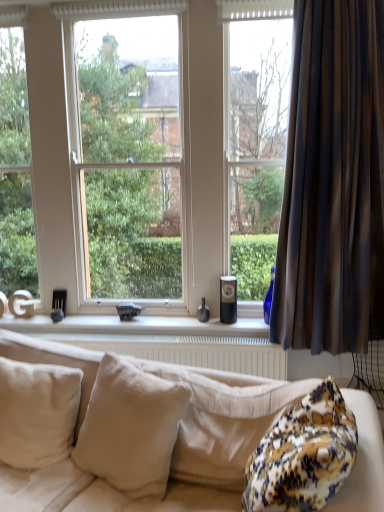
The image size is (384, 512). Identify the location of white matte window sill at center. (137, 326).

Locate an element on the screen. The width and height of the screenshot is (384, 512). beige cotton pillow at lower left, which appears as the 1th pillow when viewed from the left is located at coordinates (37, 412).

In order to face transparent glass window at center, should I rotate leftwards or rightwards?

→ To align with it, rotate left about 8.794°.

The width and height of the screenshot is (384, 512). What do you see at coordinates (333, 182) in the screenshot?
I see `brown striped curtain at right` at bounding box center [333, 182].

Image resolution: width=384 pixels, height=512 pixels. Describe the element at coordinates (363, 460) in the screenshot. I see `beige fabric couch at lower center` at that location.

Where is `white matte window sill at center`? This screenshot has height=512, width=384. white matte window sill at center is located at coordinates (137, 326).

Does white matte window sill at center have a lesser width compared to beige fabric couch at lower center?

Yes, white matte window sill at center is thinner than beige fabric couch at lower center.

Is white matte window sill at center behind beige fabric couch at lower center?

Yes.

Where is `window sill above the beige fabric couch at lower center (from the image's perspective)`? This screenshot has height=512, width=384. window sill above the beige fabric couch at lower center (from the image's perspective) is located at coordinates (x=137, y=326).

Where is `window located on the left of beige fabric pillow at center, acting as the 2th pillow starting from the left`? The height and width of the screenshot is (512, 384). window located on the left of beige fabric pillow at center, acting as the 2th pillow starting from the left is located at coordinates (138, 147).

Can you tell me how much transparent glass window at center and beige fabric pillow at center, acting as the 2th pillow starting from the left, differ in facing direction?

15.2 degrees separate the facing orientations of transparent glass window at center and beige fabric pillow at center, acting as the 2th pillow starting from the left.

Is beige fabric pillow at center, arranged as the first pillow when viewed from the right, at the back of transparent glass window at center?

That's not correct — transparent glass window at center is not looking away from beige fabric pillow at center, arranged as the first pillow when viewed from the right.

Considering the points (1, 16) and (150, 467), which point is behind, point (1, 16) or point (150, 467)?

The point (1, 16) is farther from the camera.

From a real-world perspective, between beige cotton pillow at lower left, which is counted as the second pillow, starting from the right, and brown striped curtain at right, who is vertically lower?

From a 3D spatial view, beige cotton pillow at lower left, which is counted as the second pillow, starting from the right, is below.

Does beige cotton pillow at lower left, which appears as the 1th pillow when viewed from the left, lie behind brown striped curtain at right?

No.

Is beige cotton pillow at lower left, which appears as the 1th pillow when viewed from the left, spatially inside brown striped curtain at right, or outside of it?

beige cotton pillow at lower left, which appears as the 1th pillow when viewed from the left, is located beyond the bounds of brown striped curtain at right.

Where is `radiator located behind the beige fabric pillow at center, arranged as the first pillow when viewed from the right`? The image size is (384, 512). radiator located behind the beige fabric pillow at center, arranged as the first pillow when viewed from the right is located at coordinates (191, 351).

From the image's perspective, which is above, white textured radiator at lower center or beige fabric pillow at center, arranged as the first pillow when viewed from the right?

white textured radiator at lower center appears higher in the image.

Visually, is white textured radiator at lower center positioned to the left or to the right of beige fabric pillow at center, acting as the 2th pillow starting from the left?

Clearly, white textured radiator at lower center is on the left of beige fabric pillow at center, acting as the 2th pillow starting from the left, in the image.

Based on the photo, how far apart are white textured radiator at lower center and beige fabric pillow at center, acting as the 2th pillow starting from the left?

A distance of 32.65 inches exists between white textured radiator at lower center and beige fabric pillow at center, acting as the 2th pillow starting from the left.

Which object is further away from the camera, brown striped curtain at right or white textured radiator at lower center?

Positioned behind is white textured radiator at lower center.

Based on their sizes in the image, would you say brown striped curtain at right is bigger or smaller than white textured radiator at lower center?

brown striped curtain at right is bigger than white textured radiator at lower center.

Is brown striped curtain at right looking in the opposite direction of white textured radiator at lower center?

No.

From a real-world perspective, which object stands above the other?

brown striped curtain at right, from a real-world perspective.

In the scene shown: Is beige fabric pillow at center, acting as the 2th pillow starting from the left, bigger or smaller than white matte window sill at center?

Considering their sizes, beige fabric pillow at center, acting as the 2th pillow starting from the left, takes up more space than white matte window sill at center.

From a real-world perspective, is beige fabric pillow at center, arranged as the first pillow when viewed from the right, over white matte window sill at center?

No, from a real-world perspective, beige fabric pillow at center, arranged as the first pillow when viewed from the right, is not above white matte window sill at center.

Considering the sizes of beige fabric pillow at center, acting as the 2th pillow starting from the left, and white matte window sill at center in the image, is beige fabric pillow at center, acting as the 2th pillow starting from the left, wider or thinner than white matte window sill at center?

In the image, beige fabric pillow at center, acting as the 2th pillow starting from the left, appears to be wider than white matte window sill at center.

From the picture: Relative to white matte window sill at center, is beige fabric pillow at center, acting as the 2th pillow starting from the left, in front or behind?

beige fabric pillow at center, acting as the 2th pillow starting from the left, is in front of white matte window sill at center.

Locate an element on the screen. The height and width of the screenshot is (512, 384). studio couch that is in front of the brown striped curtain at right is located at coordinates (363, 460).

From a real-world perspective, relative to beige fabric couch at lower center, is brown striped curtain at right vertically above or below?

From a real-world perspective, brown striped curtain at right is physically above beige fabric couch at lower center.

Is brown striped curtain at right thinner than beige fabric couch at lower center?

Correct, the width of brown striped curtain at right is less than that of beige fabric couch at lower center.

Where is `window sill lying behind the beige fabric couch at lower center`? This screenshot has width=384, height=512. window sill lying behind the beige fabric couch at lower center is located at coordinates (137, 326).

I want to click on window on the left of beige fabric pillow at center, acting as the 2th pillow starting from the left, so click(x=138, y=147).

Considering their positions, is beige cotton pillow at lower left, which appears as the 1th pillow when viewed from the left, positioned further to beige fabric pillow at center, acting as the 2th pillow starting from the left, than white matte window sill at center?

white matte window sill at center is further to beige fabric pillow at center, acting as the 2th pillow starting from the left.

Considering their positions, is beige fabric couch at lower center positioned closer to beige fabric pillow at center, acting as the 2th pillow starting from the left, than white textured radiator at lower center?

beige fabric couch at lower center is positioned closer to the anchor beige fabric pillow at center, acting as the 2th pillow starting from the left.

From the picture: Based on their spatial positions, is white textured radiator at lower center or white matte window sill at center closer to beige cotton pillow at lower left, which is counted as the second pillow, starting from the right?

Based on the image, white textured radiator at lower center appears to be nearer to beige cotton pillow at lower left, which is counted as the second pillow, starting from the right.

From the image, which object appears to be nearer to beige fabric pillow at center, acting as the 2th pillow starting from the left, white matte window sill at center or transparent glass window at center?

Among the two, white matte window sill at center is located nearer to beige fabric pillow at center, acting as the 2th pillow starting from the left.

Considering their positions, is beige fabric couch at lower center positioned further to white matte window sill at center than brown striped curtain at right?

brown striped curtain at right is further to white matte window sill at center.

When comparing their distances from white textured radiator at lower center, does brown striped curtain at right or white matte window sill at center seem further?

brown striped curtain at right lies further to white textured radiator at lower center than the other object.

Consider the image. Considering their positions, is white matte window sill at center positioned further to white textured radiator at lower center than brown striped curtain at right?

brown striped curtain at right is further to white textured radiator at lower center.

Which object lies nearer to the anchor point beige cotton pillow at lower left, which is counted as the second pillow, starting from the right, white textured radiator at lower center or beige fabric pillow at center, arranged as the first pillow when viewed from the right?

beige fabric pillow at center, arranged as the first pillow when viewed from the right, is positioned closer to the anchor beige cotton pillow at lower left, which is counted as the second pillow, starting from the right.

At what (x,y) coordinates should I click in order to perform the action: click on window sill between transparent glass window at center and beige fabric pillow at center, arranged as the first pillow when viewed from the right, vertically. Please return your answer as a coordinate pair (x, y). The width and height of the screenshot is (384, 512). Looking at the image, I should click on (137, 326).

Identify the location of curtain positioned between beige fabric couch at lower center and white matte window sill at center from near to far. (333, 182).

Identify the location of pillow between beige fabric pillow at center, arranged as the first pillow when viewed from the right, and white textured radiator at lower center from front to back. pos(37,412).

This screenshot has height=512, width=384. I want to click on studio couch located between beige cotton pillow at lower left, which is counted as the second pillow, starting from the right, and brown striped curtain at right in the left-right direction, so click(363, 460).